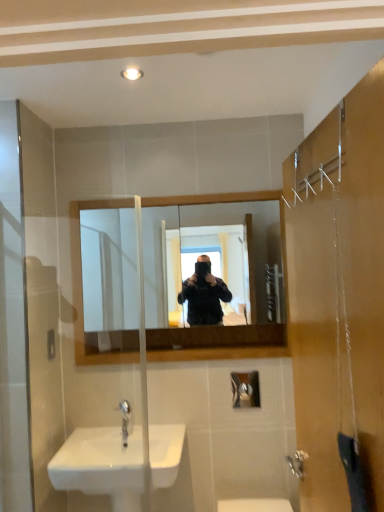
Describe the element at coordinates (132, 73) in the screenshot. The image size is (384, 512). I see `white glossy light fixture at upper center` at that location.

Where is `wooden frame mirror at center`? This screenshot has height=512, width=384. wooden frame mirror at center is located at coordinates (213, 263).

Locate an element on the screen. white glossy light fixture at upper center is located at coordinates (132, 73).

Can you tell me how much wooden frame mirror at center and silver metallic faucet at lower center differ in facing direction?

0.386 degrees separate the facing orientations of wooden frame mirror at center and silver metallic faucet at lower center.

Are wooden frame mirror at center and silver metallic faucet at lower center beside each other?

No, wooden frame mirror at center is not in contact with silver metallic faucet at lower center.

From the image's perspective, is wooden frame mirror at center located beneath silver metallic faucet at lower center?

Incorrect, from the image's perspective, wooden frame mirror at center is higher than silver metallic faucet at lower center.

Is wooden frame mirror at center bigger than silver metallic faucet at lower center?

Indeed, wooden frame mirror at center has a larger size compared to silver metallic faucet at lower center.

Which is behind, wooden frame mirror at center or white glossy sink at lower left?

Positioned behind is wooden frame mirror at center.

From the image's perspective, is wooden frame mirror at center located beneath white glossy sink at lower left?

No, from the image's perspective, wooden frame mirror at center is not below white glossy sink at lower left.

Does wooden frame mirror at center turn towards white glossy sink at lower left?

No, wooden frame mirror at center is not aimed at white glossy sink at lower left.

Considering the points (163, 430) and (139, 76), which point is behind, point (163, 430) or point (139, 76)?

The point (163, 430) is farther from the camera.

Looking at this image, from a real-world perspective, is white glossy sink at lower left on top of white glossy light fixture at upper center?

No, from a real-world perspective, white glossy sink at lower left is not above white glossy light fixture at upper center.

Which of these two, white glossy sink at lower left or white glossy light fixture at upper center, is thinner?

Thinner between the two is white glossy light fixture at upper center.

Does white glossy sink at lower left contain white glossy light fixture at upper center?

No, white glossy light fixture at upper center is not surrounded by white glossy sink at lower left.

Could you tell me if white glossy light fixture at upper center is facing silver metallic faucet at lower center?

No, white glossy light fixture at upper center does not turn towards silver metallic faucet at lower center.

Is white glossy light fixture at upper center shorter than silver metallic faucet at lower center?

Correct, white glossy light fixture at upper center is not as tall as silver metallic faucet at lower center.

From the image's perspective, between white glossy light fixture at upper center and silver metallic faucet at lower center, which one is located above?

white glossy light fixture at upper center.

Find the location of `light fixture above the silver metallic faucet at lower center (from a real-world perspective)`. light fixture above the silver metallic faucet at lower center (from a real-world perspective) is located at coordinates (132, 73).

Consider the image. Could you tell me if silver metallic faucet at lower center is facing white glossy sink at lower left?

No, silver metallic faucet at lower center does not turn towards white glossy sink at lower left.

Looking at the image, does silver metallic faucet at lower center seem bigger or smaller compared to white glossy sink at lower left?

Clearly, silver metallic faucet at lower center is smaller in size than white glossy sink at lower left.

From the image's perspective, which one is positioned higher, silver metallic faucet at lower center or white glossy sink at lower left?

silver metallic faucet at lower center.

From a real-world perspective, is silver metallic faucet at lower center over white glossy sink at lower left?

Correct, in the physical world, silver metallic faucet at lower center is higher than white glossy sink at lower left.

Does point (171, 473) come in front of point (217, 304)?

Yes, point (171, 473) is closer to viewer.

From a real-world perspective, between white glossy sink at lower left and wooden frame mirror at center, who is vertically lower?

In real-world perspective, white glossy sink at lower left is lower.

Is white glossy sink at lower left directly adjacent to wooden frame mirror at center?

No, white glossy sink at lower left is not beside wooden frame mirror at center.

Is white glossy sink at lower left bigger than wooden frame mirror at center?

Yes, white glossy sink at lower left is bigger than wooden frame mirror at center.

Considering their positions, is silver metallic faucet at lower center located in front of or behind wooden frame mirror at center?

Clearly, silver metallic faucet at lower center is in front of wooden frame mirror at center.

From the image's perspective, is silver metallic faucet at lower center below wooden frame mirror at center?

Indeed, from the image's perspective, silver metallic faucet at lower center is shown beneath wooden frame mirror at center.

Locate an element on the screen. This screenshot has width=384, height=512. tap on the left side of wooden frame mirror at center is located at coordinates (124, 420).

In order to click on sink in front of the wooden frame mirror at center in this screenshot , I will do `click(102, 465)`.

Looking at the image, which one is located further to white glossy sink at lower left, wooden frame mirror at center or silver metallic faucet at lower center?

wooden frame mirror at center is positioned further to the anchor white glossy sink at lower left.

From the image, which object appears to be farther from white glossy light fixture at upper center, wooden frame mirror at center or silver metallic faucet at lower center?

Among the two, silver metallic faucet at lower center is located further to white glossy light fixture at upper center.

Based on their spatial positions, is white glossy light fixture at upper center or silver metallic faucet at lower center closer to white glossy sink at lower left?

Among the two, silver metallic faucet at lower center is located nearer to white glossy sink at lower left.

From the image, which object appears to be nearer to wooden frame mirror at center, white glossy sink at lower left or silver metallic faucet at lower center?

white glossy sink at lower left is positioned closer to the anchor wooden frame mirror at center.

From the image, which object appears to be farther from white glossy light fixture at upper center, white glossy sink at lower left or silver metallic faucet at lower center?

The object further to white glossy light fixture at upper center is white glossy sink at lower left.

Looking at the image, which one is located closer to white glossy light fixture at upper center, wooden frame mirror at center or white glossy sink at lower left?

Based on the image, wooden frame mirror at center appears to be nearer to white glossy light fixture at upper center.

Based on the photo, estimate the real-world distances between objects in this image. Which object is further from white glossy light fixture at upper center, silver metallic faucet at lower center or white glossy sink at lower left?

Among the two, white glossy sink at lower left is located further to white glossy light fixture at upper center.

Looking at the image, which one is located further to white glossy light fixture at upper center, white glossy sink at lower left or wooden frame mirror at center?

white glossy sink at lower left is positioned further to the anchor white glossy light fixture at upper center.

The image size is (384, 512). Identify the location of mirror between white glossy light fixture at upper center and white glossy sink at lower left in the vertical direction. (213, 263).

Where is `tap that lies between white glossy light fixture at upper center and white glossy sink at lower left from top to bottom`? This screenshot has width=384, height=512. tap that lies between white glossy light fixture at upper center and white glossy sink at lower left from top to bottom is located at coordinates (124, 420).

At what (x,y) coordinates should I click in order to perform the action: click on tap between wooden frame mirror at center and white glossy sink at lower left vertically. Please return your answer as a coordinate pair (x, y). This screenshot has width=384, height=512. Looking at the image, I should click on (124, 420).

Locate an element on the screen. mirror between white glossy light fixture at upper center and silver metallic faucet at lower center from top to bottom is located at coordinates (213, 263).